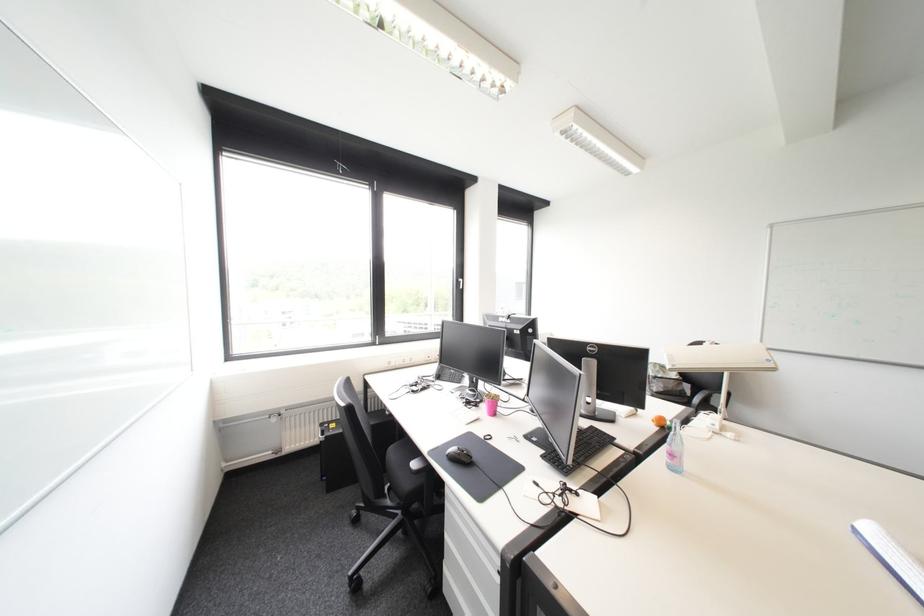
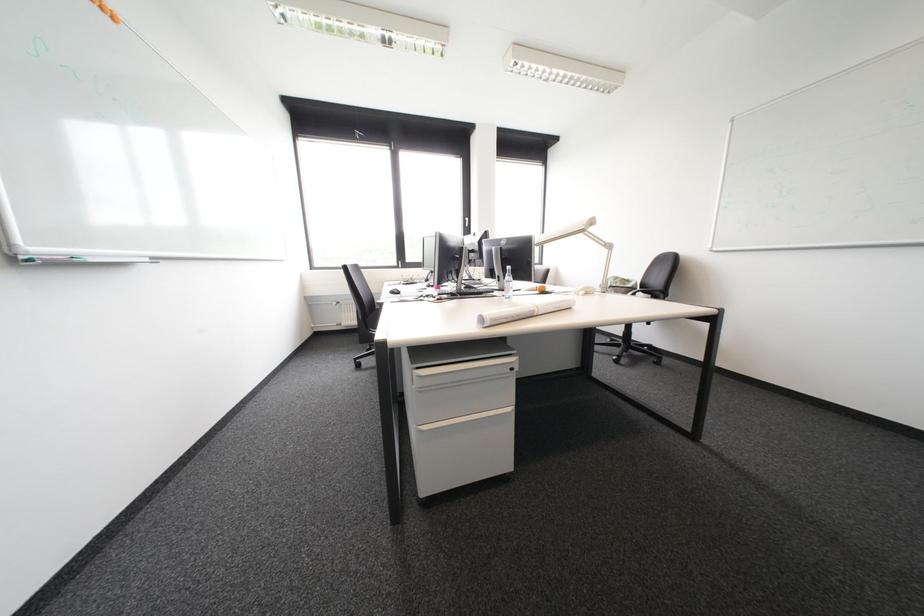
Question: I am providing you with two images of the same scene from different viewpoints. Which of the following objects are not visible in image2?

Choices:
 (A) red cushion
 (B) bottom drawer handle
 (C) black computer mouse
 (D) top drawer handle

Answer: (C)